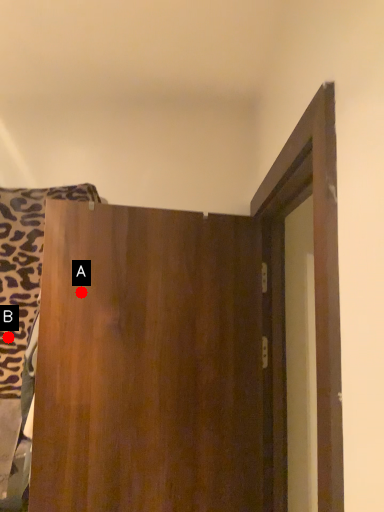
Question: Two points are circled on the image, labeled by A and B beside each circle. Which point is closer to the camera?

Choices:
 (A) A is closer
 (B) B is closer

Answer: (A)